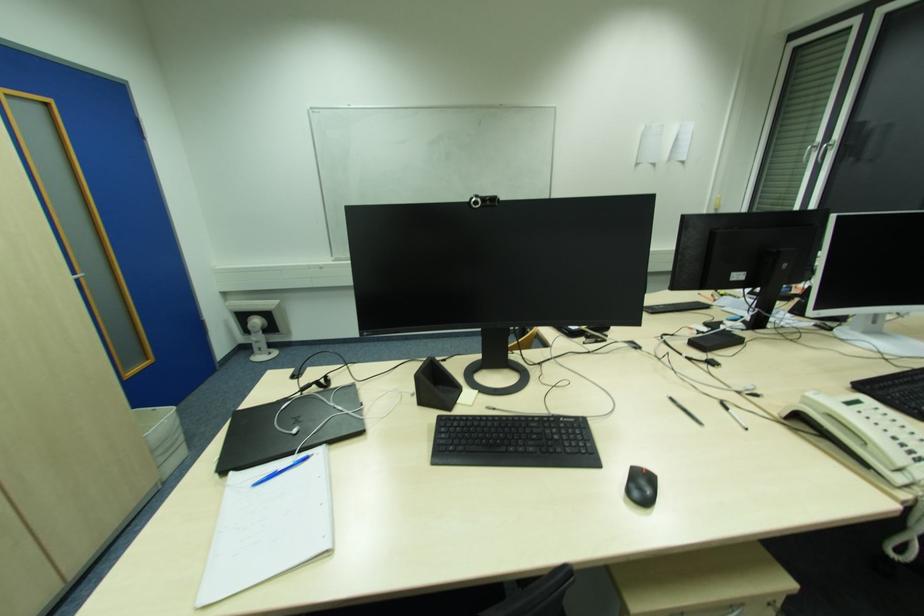
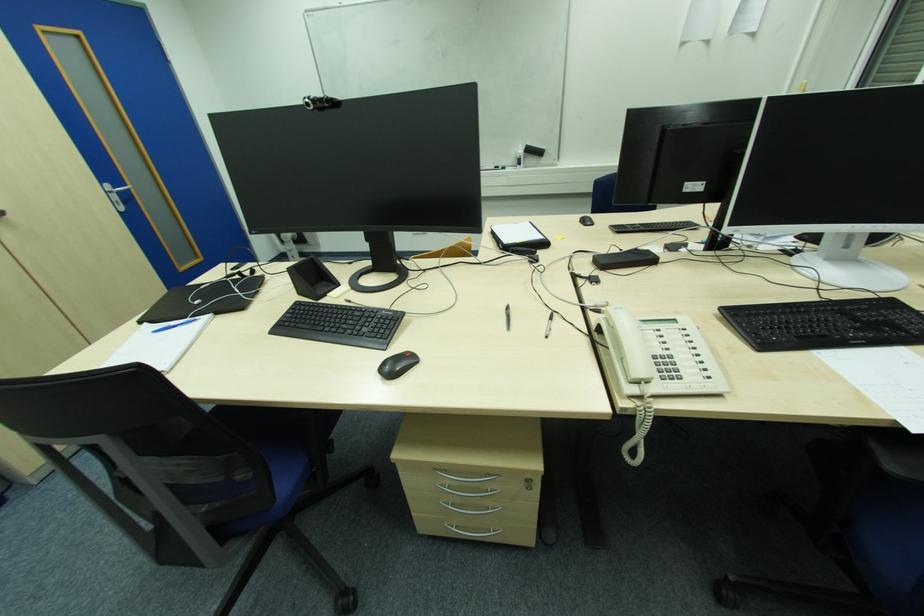
The point at (532, 444) is marked in the first image. Where is the corresponding point in the second image?

(346, 328)